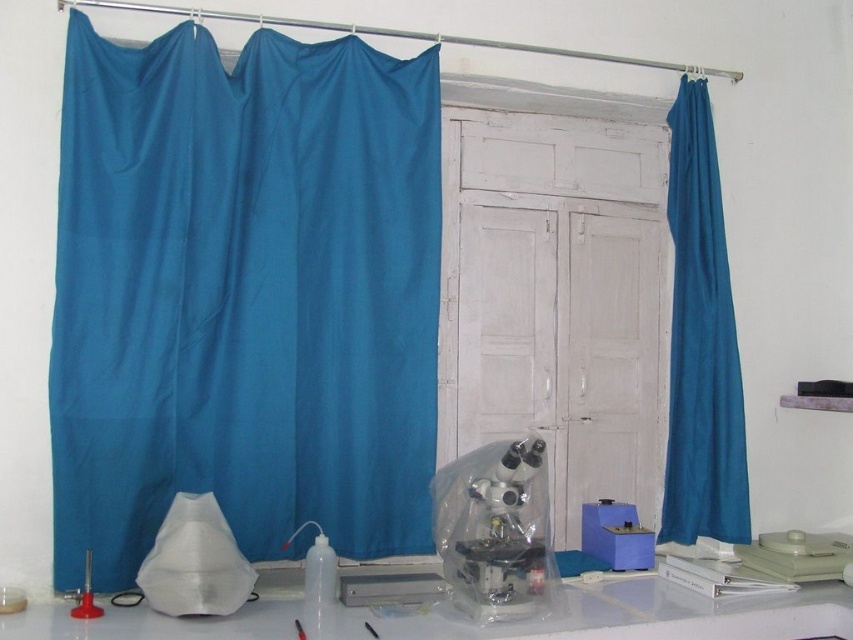
Question: Estimate the real-world distances between objects in this image. Which object is closer to the matte red stand at lower left?

Choices:
 (A) clear plastic microscope at center
 (B) white plastic table at lower center
 (C) teal fabric curtain at left
 (D) teal fabric curtain at right

Answer: (B)

Question: Can you confirm if white plastic table at lower center is positioned to the left of matte red stand at lower left?

Choices:
 (A) yes
 (B) no

Answer: (B)

Question: Considering the relative positions of teal fabric curtain at left and white plastic table at lower center in the image provided, where is teal fabric curtain at left located with respect to white plastic table at lower center?

Choices:
 (A) below
 (B) above

Answer: (B)

Question: Which point is closer to the camera taking this photo?

Choices:
 (A) (71, 608)
 (B) (534, 512)
 (C) (689, 298)
 (D) (729, 620)

Answer: (A)

Question: Which is nearer to the white plastic table at lower center?

Choices:
 (A) clear plastic microscope at center
 (B) teal fabric curtain at right
 (C) matte red stand at lower left
 (D) teal fabric curtain at left

Answer: (A)

Question: Is teal fabric curtain at right thinner than white plastic table at lower center?

Choices:
 (A) yes
 (B) no

Answer: (A)